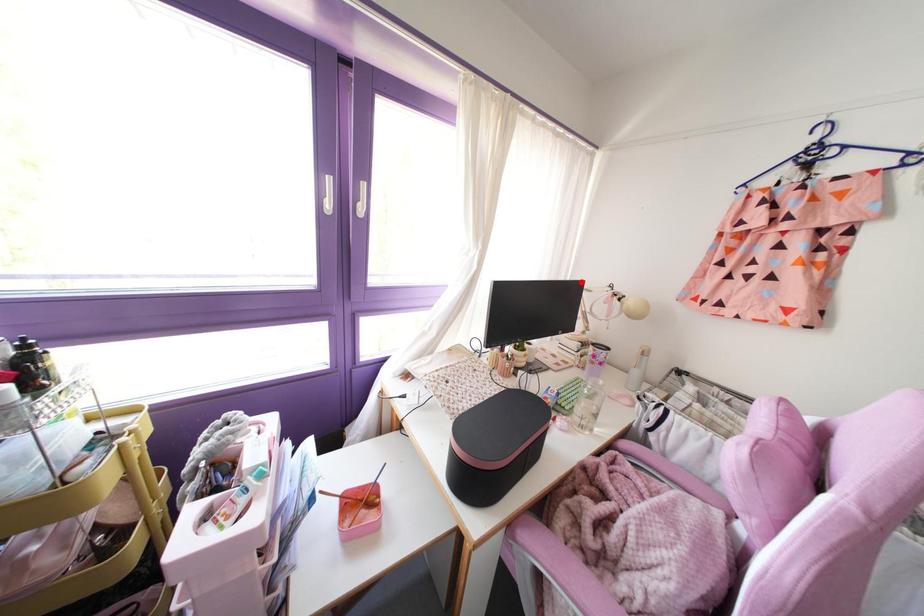
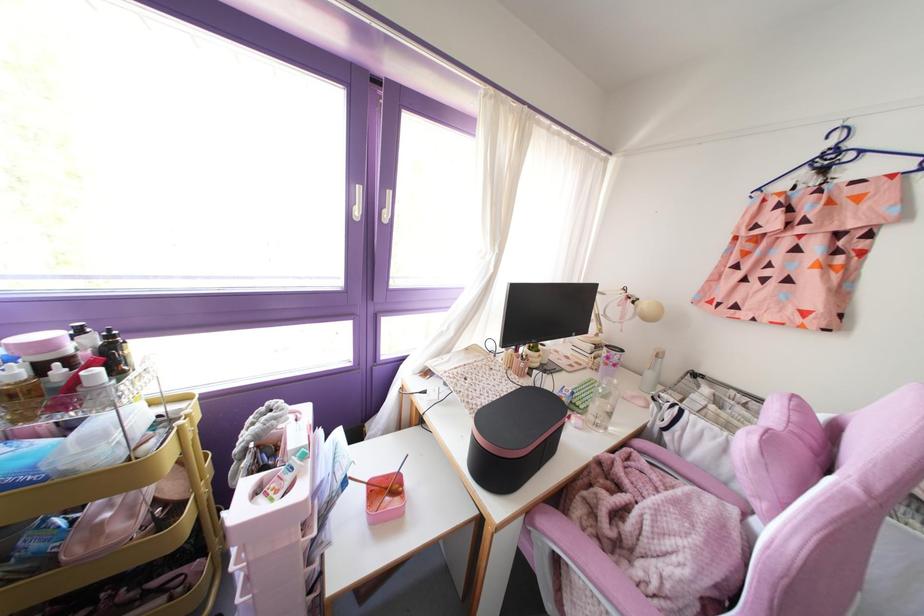
Find the pixel in the second image that matches the highlighted location in the first image.

(594, 285)